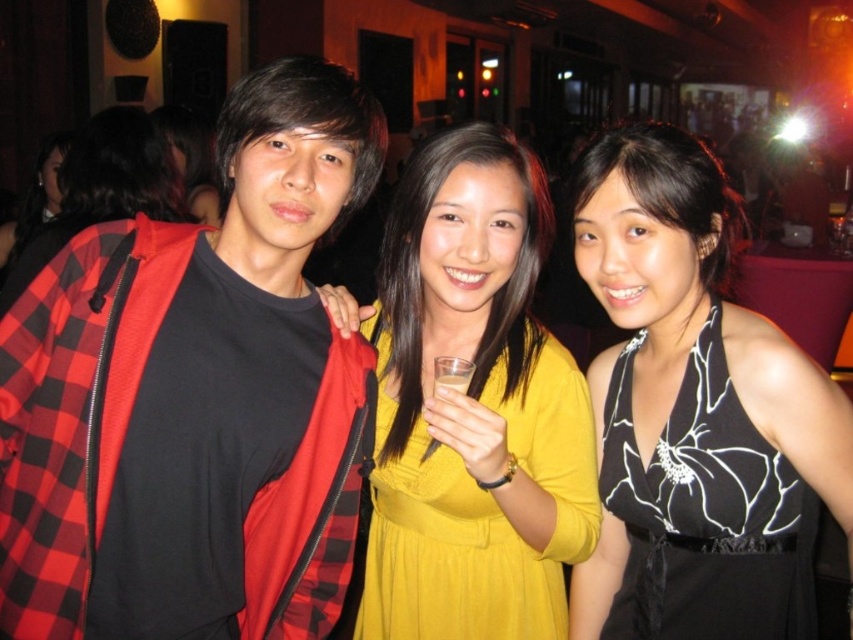
Between yellow satin dress at center and black satin dress at center, which one has more height?

yellow satin dress at center

Does yellow satin dress at center appear on the left side of black satin dress at center?

Indeed, yellow satin dress at center is positioned on the left side of black satin dress at center.

Who is more distant from viewer, (593, 484) or (720, 422)?

The point (593, 484) is behind.

In order to click on yellow satin dress at center in this screenshot , I will do `click(479, 509)`.

Which is above, yellow satin dress at center or translucent plastic cup at center?

translucent plastic cup at center

Is yellow satin dress at center to the right of translucent plastic cup at center from the viewer's perspective?

Incorrect, yellow satin dress at center is not on the right side of translucent plastic cup at center.

Is point (560, 387) positioned before point (457, 378)?

No, it is not.

I want to click on yellow satin dress at center, so click(479, 509).

Between yellow matte dress at center and translucent plastic cup at center, which one has more height?

yellow matte dress at center

Where is `yellow matte dress at center`? The width and height of the screenshot is (853, 640). yellow matte dress at center is located at coordinates (103, 188).